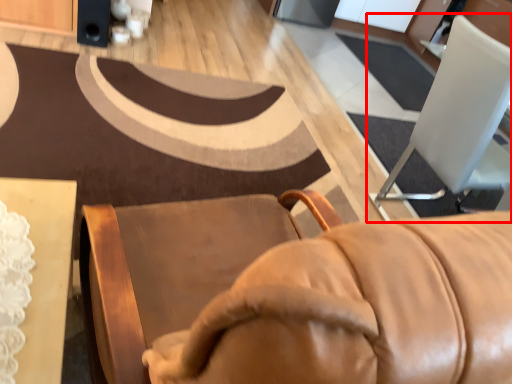
Question: Where is chair (annotated by the red box) located in relation to speaker in the image?

Choices:
 (A) left
 (B) right

Answer: (B)